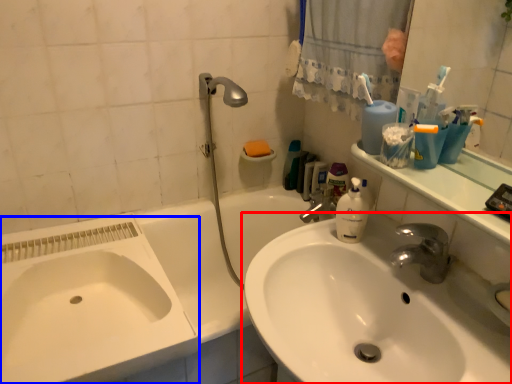
Question: Which object appears closest to the camera in this image, sink (highlighted by a red box) or sink (highlighted by a blue box)?

Choices:
 (A) sink
 (B) sink

Answer: (A)